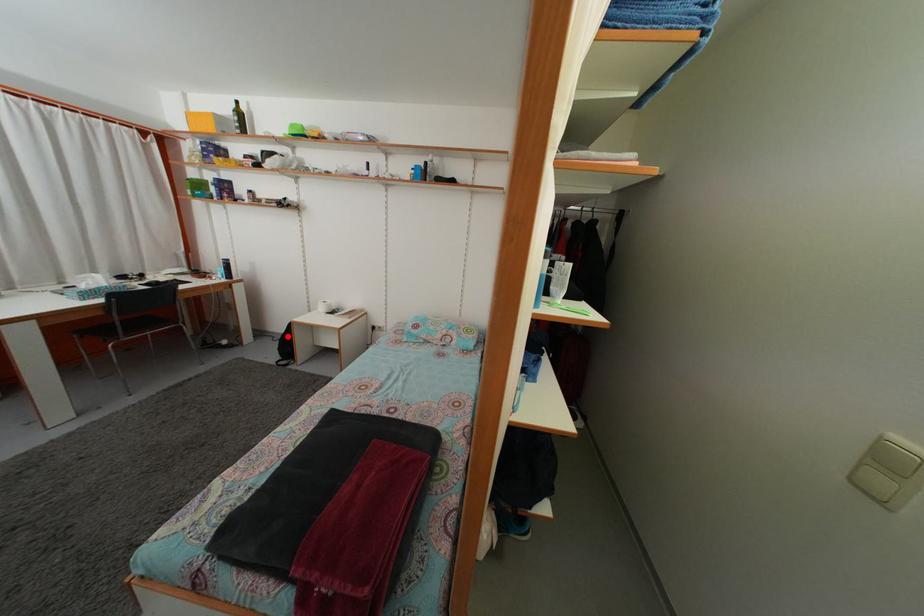
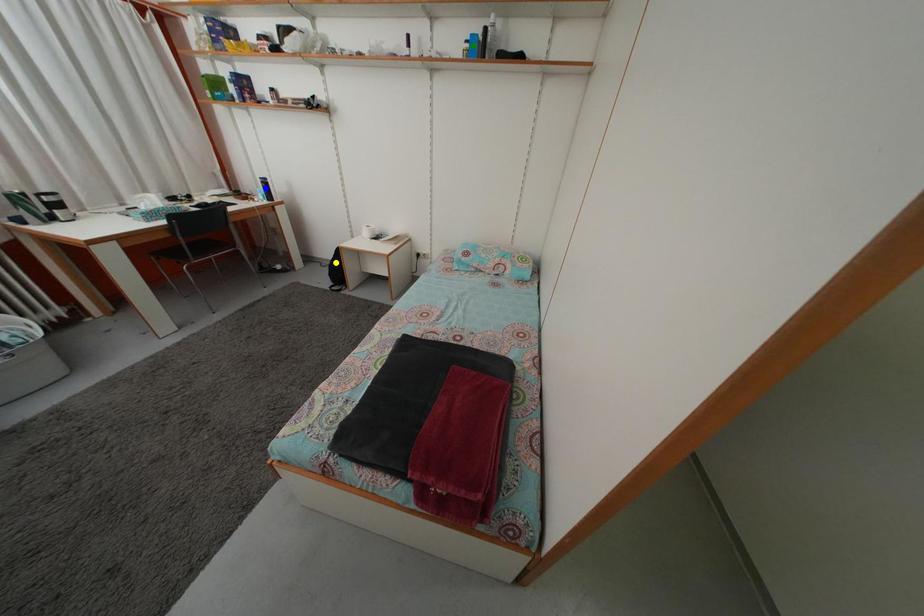
Question: I am providing you with two images of the same scene from different viewpoints. A red point is marked on the first image. You are given multiple points on the second image. Which mark in image 2 goes with the point in image 1?

Choices:
 (A) yellow point
 (B) blue point
 (C) green point

Answer: (A)